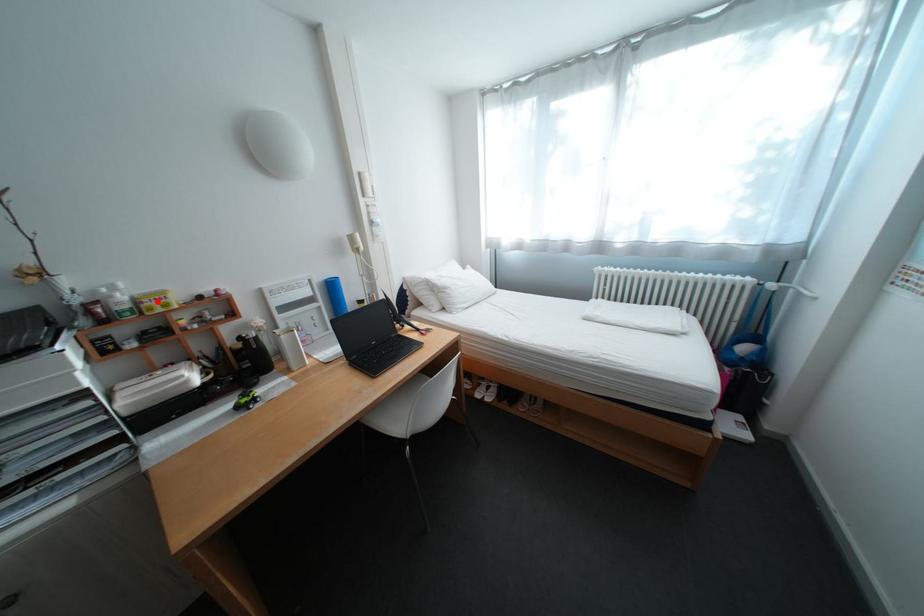
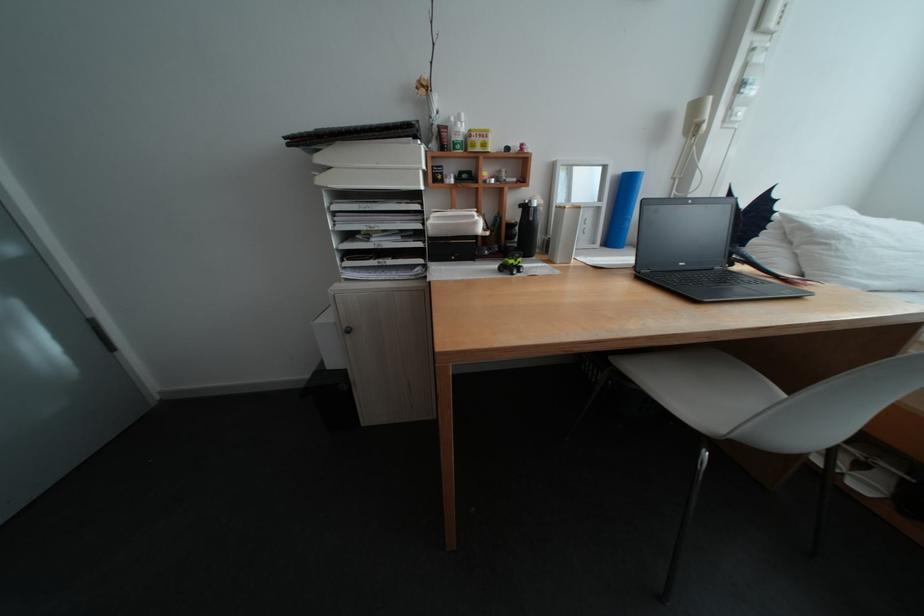
Find the pixel in the second image that matches the highlighted location in the first image.

(485, 135)